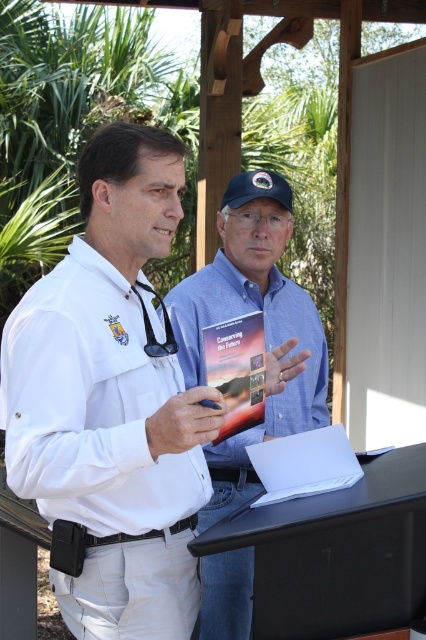
The scene shows two men under a wooden structure. The first man is on the left wearing a white long sleeve shirt with a logo on the chest and a black walkie talkie on his belt. The second man is on the right wearing a blue button up shirt and holding a book titled Conserving the Future. There is a point marked at coordinates [111,403]. Which object from the following list is located at this point? The options are the white long sleeved shirt at center, the blue button up shirt, or the book titled Conserv

The point at coordinates [111,403] indicates the white matte shirt at center, which is the same as the white long sleeved shirt at center worn by the first man on the left.

You are a photographer positioned behind the two men in the scene. You want to take a clear photo of both the white matte shirt at center and the black rubber stethoscope at center. Which object will appear larger in your photo?

The white matte shirt at center will appear larger in the photo because it is closer to the viewer than the black rubber stethoscope at center.